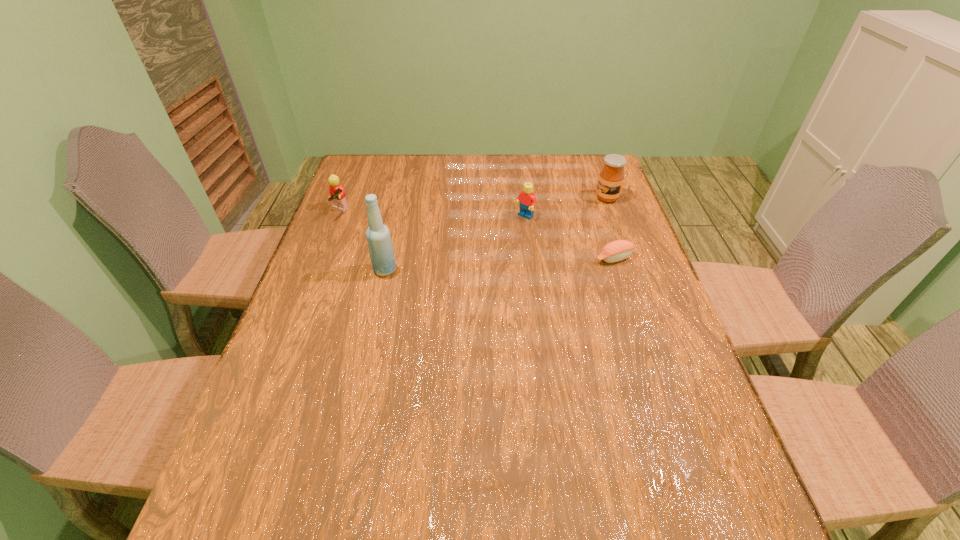
Identify the location of free space located 0.130m on the front-facing side of the honey. (573, 218).

The height and width of the screenshot is (540, 960). What are the coordinates of `free space located on the face of the right Lego` in the screenshot? It's located at (503, 234).

Where is `blank space located 0.290m on the face of the right Lego`? blank space located 0.290m on the face of the right Lego is located at coordinates (458, 273).

Find the location of a particular element. vacant space located 0.310m on the face of the right Lego is located at coordinates (453, 278).

Where is `free space located in front of the left Lego with the accessory visible`? The image size is (960, 540). free space located in front of the left Lego with the accessory visible is located at coordinates (455, 259).

The image size is (960, 540). In order to click on vacant area located in front of the left Lego with the accessory visible in this screenshot , I will do `click(425, 248)`.

Locate an element on the screen. vacant space situated in front of the left Lego with the accessory visible is located at coordinates (380, 231).

You are a GUI agent. You are given a task and a screenshot of the screen. Output one action in this format:
    pyautogui.click(x=<x>, y=<y>)
    Task: Click on the object at the left edge
    This screenshot has height=540, width=960.
    Given the screenshot: What is the action you would take?
    pyautogui.click(x=337, y=194)

Where is `sushi located in the right edge section of the desktop`? sushi located in the right edge section of the desktop is located at coordinates coord(618,250).

I want to click on honey that is at the right edge, so click(611, 177).